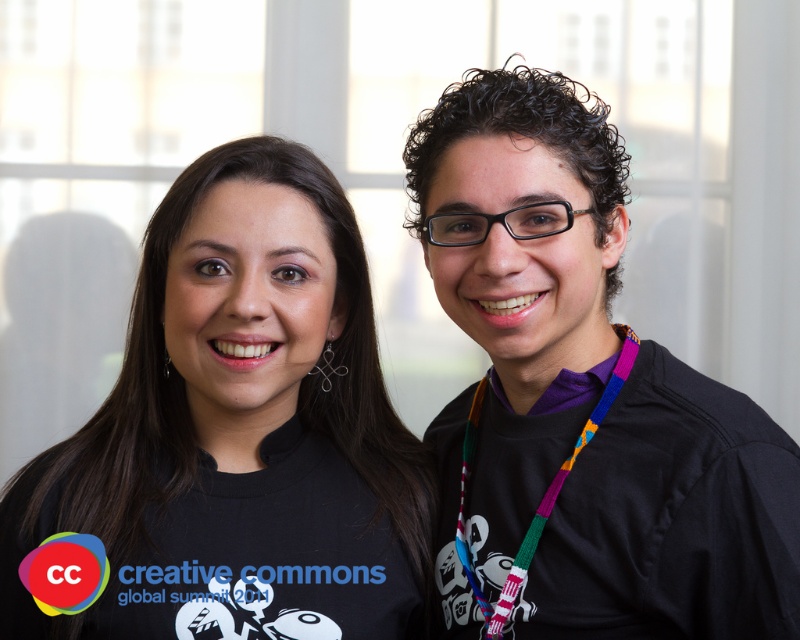
Which is above, black fabric shirt at right or multicolored woven lanyard at center?

black fabric shirt at right is above.

What do you see at coordinates (516, 300) in the screenshot? I see `black fabric shirt at right` at bounding box center [516, 300].

Does point (533, 483) come farther from viewer compared to point (464, 532)?

That is False.

This screenshot has width=800, height=640. Identify the location of black fabric shirt at right. pyautogui.click(x=516, y=300).

Looking at this image, is matte black neck at center further to the viewer compared to purple fabric at center?

No, matte black neck at center is in front of purple fabric at center.

Does point (250, 401) lie in front of point (618, 355)?

No, it is not.

Find the location of a particular element. matte black neck at center is located at coordinates (238, 406).

Is the position of black matte shirt at left less distant than that of black fabric shirt at right?

No, it is behind black fabric shirt at right.

What do you see at coordinates (260, 444) in the screenshot?
I see `black matte shirt at left` at bounding box center [260, 444].

Who is more distant from viewer, (154, 317) or (505, 436)?

Point (154, 317)

At what (x,y) coordinates should I click in order to perform the action: click on black matte shirt at left. Please return your answer as a coordinate pair (x, y). Looking at the image, I should click on (260, 444).